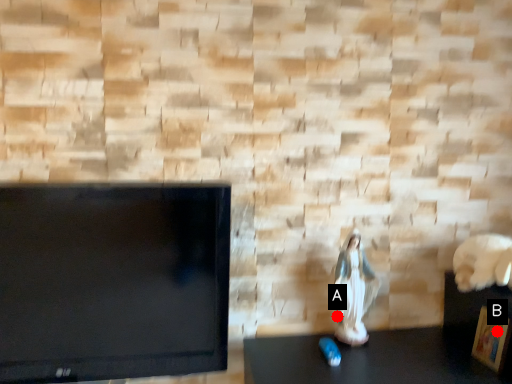
Question: Two points are circled on the image, labeled by A and B beside each circle. Which point is farther to the camera?

Choices:
 (A) A is further
 (B) B is further

Answer: (A)